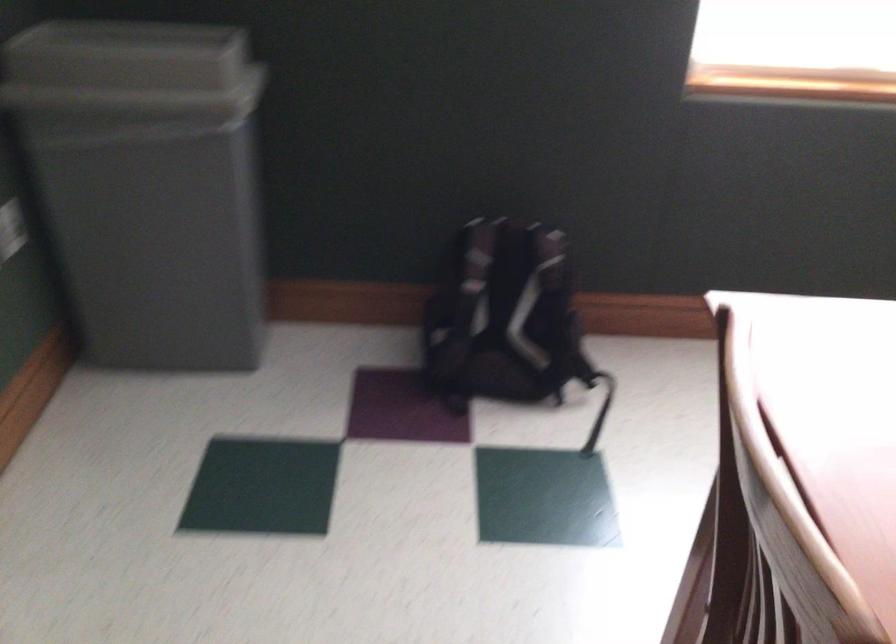
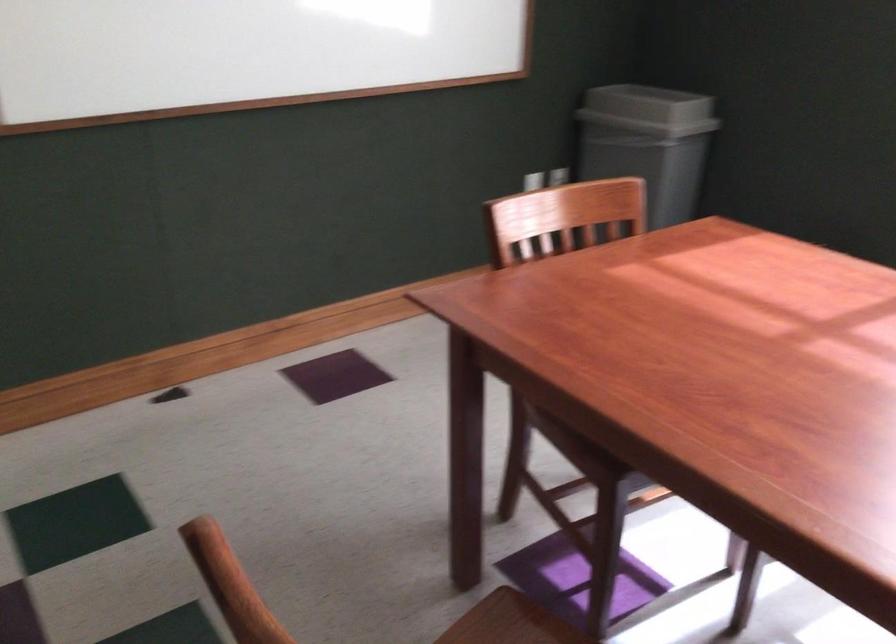
In the second image, find the point that corresponds to the point at 194,73 in the first image.

(648, 109)